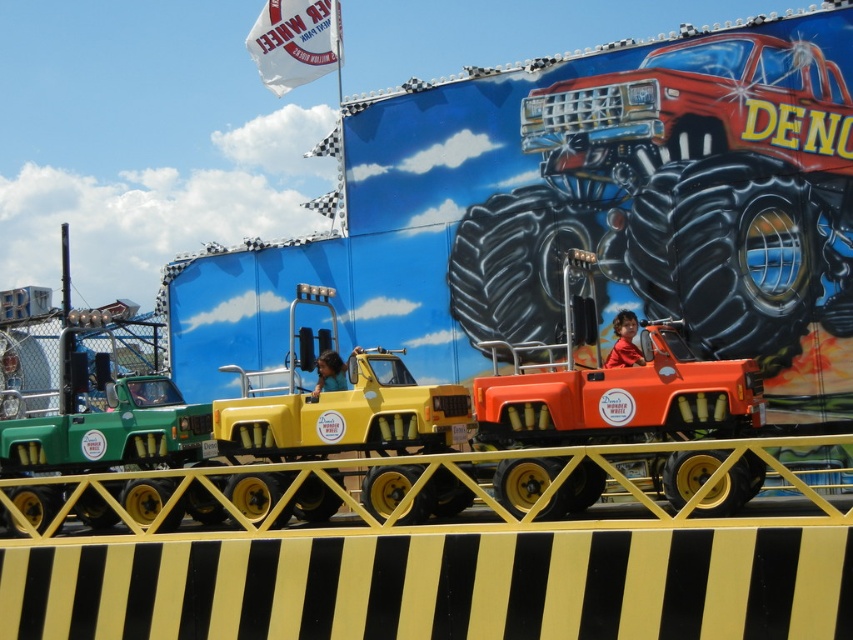
Is orange matte toy truck at center closer to camera compared to yellow matte truck at center?

Yes, it is.

Is orange matte toy truck at center taller than yellow matte truck at center?

Indeed, orange matte toy truck at center has a greater height compared to yellow matte truck at center.

Is point (730, 378) farther from camera compared to point (395, 416)?

That is False.

I want to click on orange matte toy truck at center, so click(612, 387).